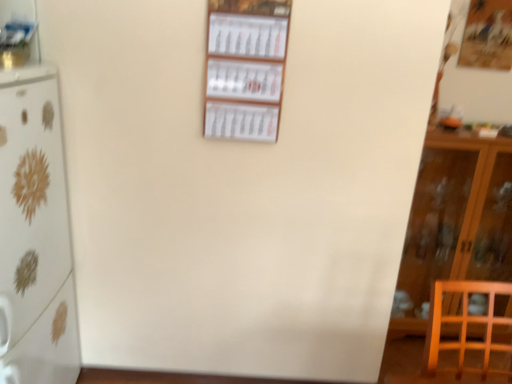
Locate an element on the screen. This screenshot has width=512, height=384. white paper calendar at center, which is the 2th shelf in left-to-right order is located at coordinates (245, 68).

The height and width of the screenshot is (384, 512). Describe the element at coordinates (245, 68) in the screenshot. I see `white paper calendar at center, which is the 2th shelf in left-to-right order` at that location.

At what (x,y) coordinates should I click in order to perform the action: click on wooden cabinet at right. Please return your answer as a coordinate pair (x, y). Image resolution: width=512 pixels, height=384 pixels. Looking at the image, I should click on (455, 221).

Which is behind, point (507, 210) or point (266, 138)?

The point (507, 210) is behind.

Measure the distance between wooden cabinet at right and white paper calendar at center, the first shelf viewed from the right.

They are 4.20 feet apart.

Does wooden cabinet at right lie in front of white paper calendar at center, which is the 2th shelf in left-to-right order?

No, wooden cabinet at right is behind white paper calendar at center, which is the 2th shelf in left-to-right order.

Which object is positioned more to the left, wooden cabinet at right or white paper calendar at center, which is the 2th shelf in left-to-right order?

Positioned to the left is white paper calendar at center, which is the 2th shelf in left-to-right order.

Considering the sizes of objects metallic silver shelf at upper left, which is the 2th shelf from right to left, and wooden cabinet at right in the image provided, who is thinner, metallic silver shelf at upper left, which is the 2th shelf from right to left, or wooden cabinet at right?

metallic silver shelf at upper left, which is the 2th shelf from right to left, is thinner.

From a real-world perspective, which is physically below, metallic silver shelf at upper left, the first shelf viewed from the left, or wooden cabinet at right?

In real-world perspective, wooden cabinet at right is lower.

Could you tell me if metallic silver shelf at upper left, the first shelf viewed from the left, is turned towards wooden cabinet at right?

No, metallic silver shelf at upper left, the first shelf viewed from the left, is not oriented towards wooden cabinet at right.

Does metallic silver shelf at upper left, the first shelf viewed from the left, have a greater height compared to wooden cabinet at right?

In fact, metallic silver shelf at upper left, the first shelf viewed from the left, may be shorter than wooden cabinet at right.

Considering the points (216, 79) and (77, 365), which point is behind, point (216, 79) or point (77, 365)?

The point (77, 365) is farther from the camera.

Can you confirm if white paper calendar at center, the first shelf viewed from the right, is positioned to the right of white glossy refrigerator at left?

Yes, white paper calendar at center, the first shelf viewed from the right, is to the right of white glossy refrigerator at left.

Who is smaller, white paper calendar at center, the first shelf viewed from the right, or white glossy refrigerator at left?

white paper calendar at center, the first shelf viewed from the right.

Can you confirm if white paper calendar at center, the first shelf viewed from the right, is wider than white glossy refrigerator at left?

Incorrect, the width of white paper calendar at center, the first shelf viewed from the right, does not surpass that of white glossy refrigerator at left.

From the image's perspective, is white glossy refrigerator at left located above metallic silver shelf at upper left, the first shelf viewed from the left?

No, from the image's perspective, white glossy refrigerator at left is not above metallic silver shelf at upper left, the first shelf viewed from the left.

Considering the sizes of white glossy refrigerator at left and metallic silver shelf at upper left, the first shelf viewed from the left, in the image, is white glossy refrigerator at left bigger or smaller than metallic silver shelf at upper left, the first shelf viewed from the left,?

Considering their sizes, white glossy refrigerator at left takes up more space than metallic silver shelf at upper left, the first shelf viewed from the left.

Which of these two, white glossy refrigerator at left or metallic silver shelf at upper left, which is the 2th shelf from right to left, is wider?

white glossy refrigerator at left is wider.

Is the depth of white glossy refrigerator at left greater than that of metallic silver shelf at upper left, which is the 2th shelf from right to left?

No.

Is metallic silver shelf at upper left, the first shelf viewed from the left, far away from white paper calendar at center, which is the 2th shelf in left-to-right order?

They are positioned close to each other.

You are a GUI agent. You are given a task and a screenshot of the screen. Output one action in this format:
    pyautogui.click(x=<x>, y=<y>)
    Task: Click on the shelf that is above the white paper calendar at center, which is the 2th shelf in left-to-right order (from a real-world perspective)
    
    Given the screenshot: What is the action you would take?
    pyautogui.click(x=17, y=10)

Considering the relative positions of metallic silver shelf at upper left, which is the 2th shelf from right to left, and white paper calendar at center, the first shelf viewed from the right, in the image provided, is metallic silver shelf at upper left, which is the 2th shelf from right to left, to the left or to the right of white paper calendar at center, the first shelf viewed from the right,?

In the image, metallic silver shelf at upper left, which is the 2th shelf from right to left, appears on the left side of white paper calendar at center, the first shelf viewed from the right.

In terms of width, does metallic silver shelf at upper left, which is the 2th shelf from right to left, look wider or thinner when compared to white paper calendar at center, which is the 2th shelf in left-to-right order?

Clearly, metallic silver shelf at upper left, which is the 2th shelf from right to left, has less width compared to white paper calendar at center, which is the 2th shelf in left-to-right order.

What's the angular difference between metallic silver shelf at upper left, the first shelf viewed from the left, and white glossy refrigerator at left's facing directions?

The angular difference between metallic silver shelf at upper left, the first shelf viewed from the left, and white glossy refrigerator at left is 90 degrees.

Considering the sizes of objects metallic silver shelf at upper left, which is the 2th shelf from right to left, and white glossy refrigerator at left in the image provided, who is bigger, metallic silver shelf at upper left, which is the 2th shelf from right to left, or white glossy refrigerator at left?

white glossy refrigerator at left is bigger.

Which is closer to the camera, (12, 6) or (12, 77)?

Clearly, point (12, 6) is more distant from the camera than point (12, 77).

Would you say wooden cabinet at right is part of white glossy refrigerator at left's contents?

No, white glossy refrigerator at left does not contain wooden cabinet at right.

Does white glossy refrigerator at left have a lesser height compared to wooden cabinet at right?

No.

Does white glossy refrigerator at left turn towards wooden cabinet at right?

No.

From a real-world perspective, does white glossy refrigerator at left stand above wooden cabinet at right?

Correct, in the physical world, white glossy refrigerator at left is higher than wooden cabinet at right.

Starting from the wooden cabinet at right, which shelf is the 1st one in front? Please provide its 2D coordinates.

[(245, 68)]

Starting from the wooden cabinet at right, which shelf is the 2nd one to the left? Please provide its 2D coordinates.

[(17, 10)]

Looking at the image, which one is located further to white paper calendar at center, which is the 2th shelf in left-to-right order, metallic silver shelf at upper left, which is the 2th shelf from right to left, or wooden cabinet at right?

wooden cabinet at right.

Estimate the real-world distances between objects in this image. Which object is closer to white glossy refrigerator at left, metallic silver shelf at upper left, which is the 2th shelf from right to left, or wooden cabinet at right?

Among the two, metallic silver shelf at upper left, which is the 2th shelf from right to left, is located nearer to white glossy refrigerator at left.

When comparing their distances from wooden cabinet at right, does white paper calendar at center, which is the 2th shelf in left-to-right order, or metallic silver shelf at upper left, the first shelf viewed from the left, seem closer?

white paper calendar at center, which is the 2th shelf in left-to-right order, is positioned closer to the anchor wooden cabinet at right.

From the image, which object appears to be farther from metallic silver shelf at upper left, which is the 2th shelf from right to left, wooden cabinet at right or white glossy refrigerator at left?

wooden cabinet at right is positioned further to the anchor metallic silver shelf at upper left, which is the 2th shelf from right to left.

Estimate the real-world distances between objects in this image. Which object is further from metallic silver shelf at upper left, the first shelf viewed from the left, white paper calendar at center, which is the 2th shelf in left-to-right order, or wooden cabinet at right?

Based on the image, wooden cabinet at right appears to be further to metallic silver shelf at upper left, the first shelf viewed from the left.

Estimate the real-world distances between objects in this image. Which object is further from white glossy refrigerator at left, wooden cabinet at right or metallic silver shelf at upper left, which is the 2th shelf from right to left?

Among the two, wooden cabinet at right is located further to white glossy refrigerator at left.

When comparing their distances from metallic silver shelf at upper left, which is the 2th shelf from right to left, does white glossy refrigerator at left or white paper calendar at center, the first shelf viewed from the right, seem closer?

Based on the image, white glossy refrigerator at left appears to be nearer to metallic silver shelf at upper left, which is the 2th shelf from right to left.

Based on their spatial positions, is white glossy refrigerator at left or metallic silver shelf at upper left, the first shelf viewed from the left, further from white paper calendar at center, which is the 2th shelf in left-to-right order?

metallic silver shelf at upper left, the first shelf viewed from the left, is further to white paper calendar at center, which is the 2th shelf in left-to-right order.

Find the location of `shelf between metallic silver shelf at upper left, which is the 2th shelf from right to left, and wooden cabinet at right`. shelf between metallic silver shelf at upper left, which is the 2th shelf from right to left, and wooden cabinet at right is located at coordinates (245, 68).

This screenshot has height=384, width=512. In order to click on shelf located between white glossy refrigerator at left and white paper calendar at center, which is the 2th shelf in left-to-right order, in the left-right direction in this screenshot , I will do `click(17, 10)`.